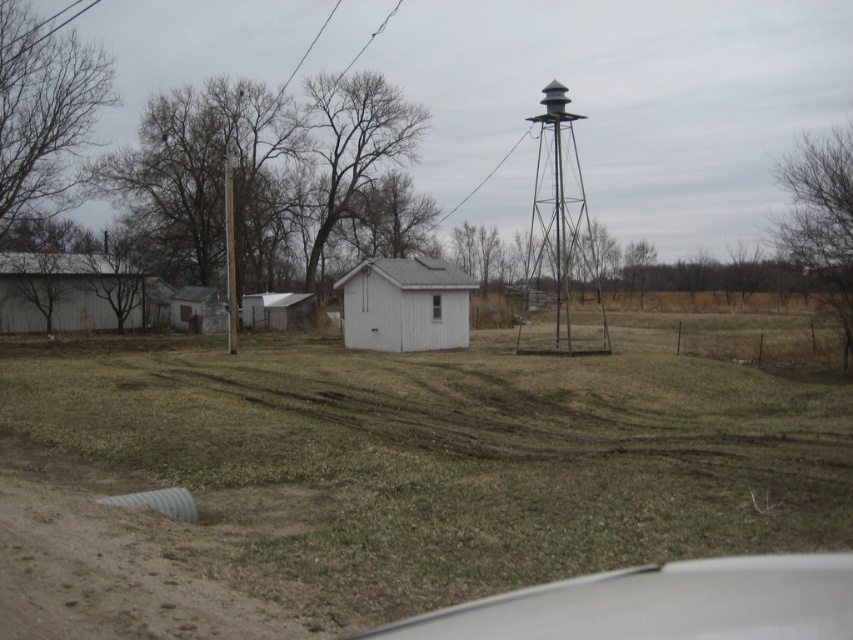
You are driving a car and looking through the white glossy car window at lower center. You notice the metallic gray water tower at right in the distance. Can you determine if the water tower is taller than your car window?

The white glossy car window at lower center is shorter than the metallic gray water tower at right, so yes, the water tower is taller than the car window.

You are standing in the field and want to look through the white glossy car window at lower center and the white wood shed at center. Which object is nearer to you?

The white glossy car window at lower center is closer to the viewer than the white wood shed at center, so it is nearer to you.

You are standing at the entrance of the shed and want to look through the white glossy car window at lower center. In which direction should you turn your head to see it?

Since the white glossy car window at lower center is located at point (660, 604) in 2D coordinates, you should turn your head to the right to look at it.